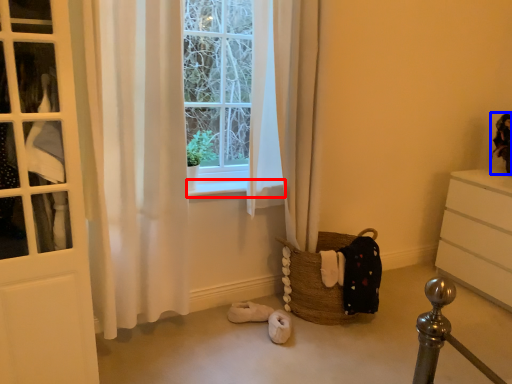
Question: Which object is closer to the camera taking this photo, window sill (highlighted by a red box) or doll (highlighted by a blue box)?

Choices:
 (A) window sill
 (B) doll

Answer: (A)